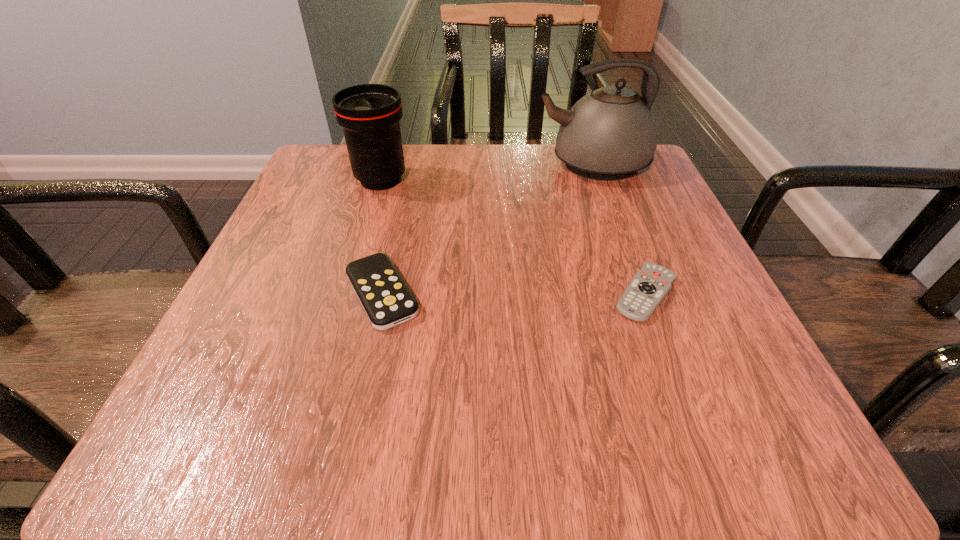
What are the coordinates of `vacant space that satisfies the following two spatial constraints: 1. at the spout of the tallest object; 2. on the right side of the shorter remote control` in the screenshot? It's located at (638, 294).

This screenshot has height=540, width=960. Identify the location of vacant space that satisfies the following two spatial constraints: 1. on the back side of the shorter remote control; 2. on the left side of the left remote control. (382, 294).

Identify the location of vacant area that satisfies the following two spatial constraints: 1. at the spout of the shortest object; 2. on the left side of the tallest object. The height and width of the screenshot is (540, 960). (638, 294).

The height and width of the screenshot is (540, 960). Find the location of `blank area in the image that satisfies the following two spatial constraints: 1. at the spout of the kettle; 2. on the front side of the third tallest object`. blank area in the image that satisfies the following two spatial constraints: 1. at the spout of the kettle; 2. on the front side of the third tallest object is located at coordinates (638, 294).